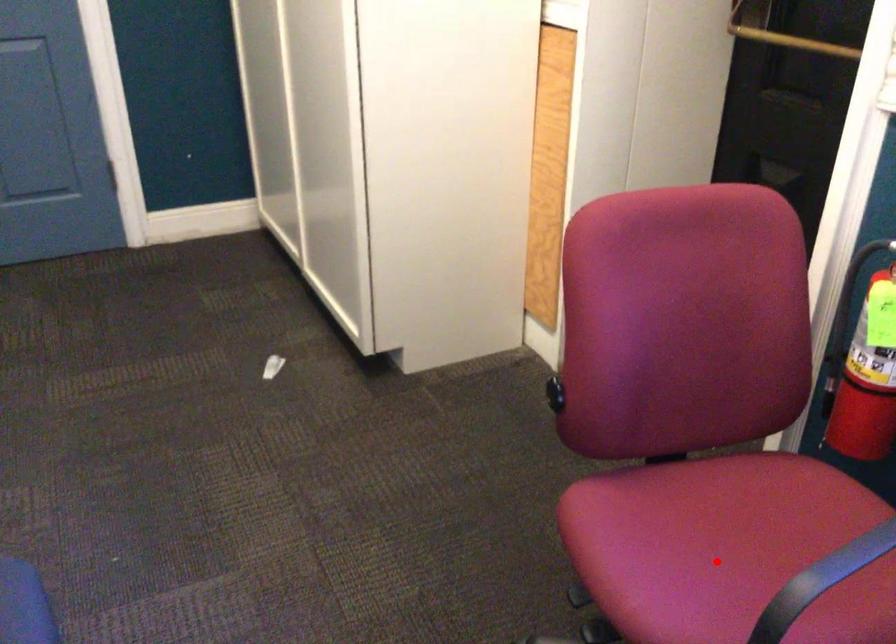
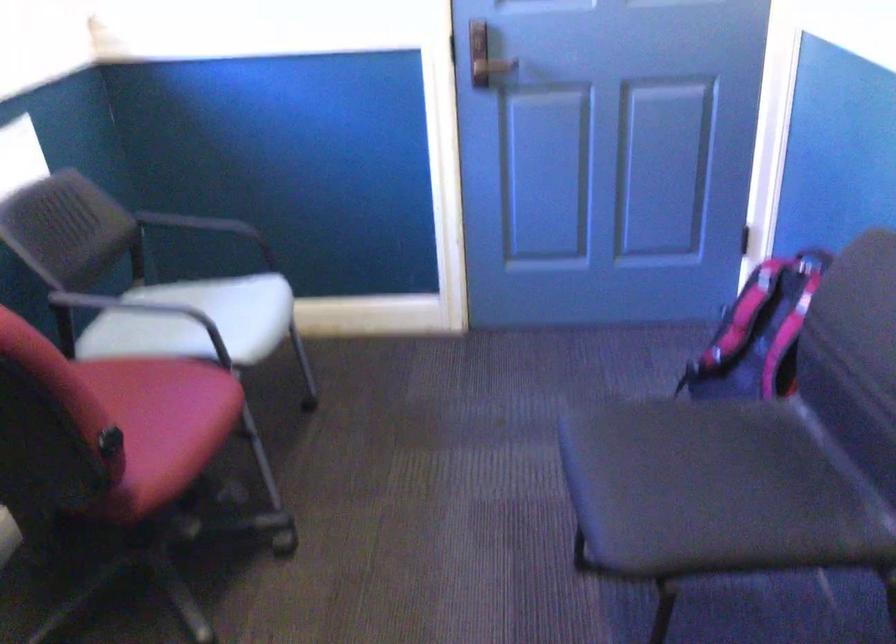
The point at the highlighted location is marked in the first image. Where is the corresponding point in the second image?

(149, 402)